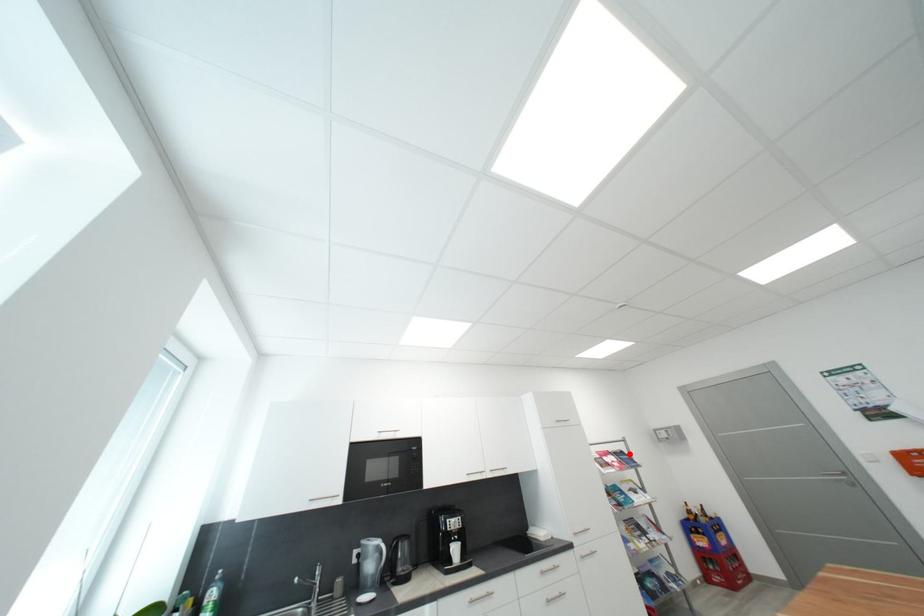
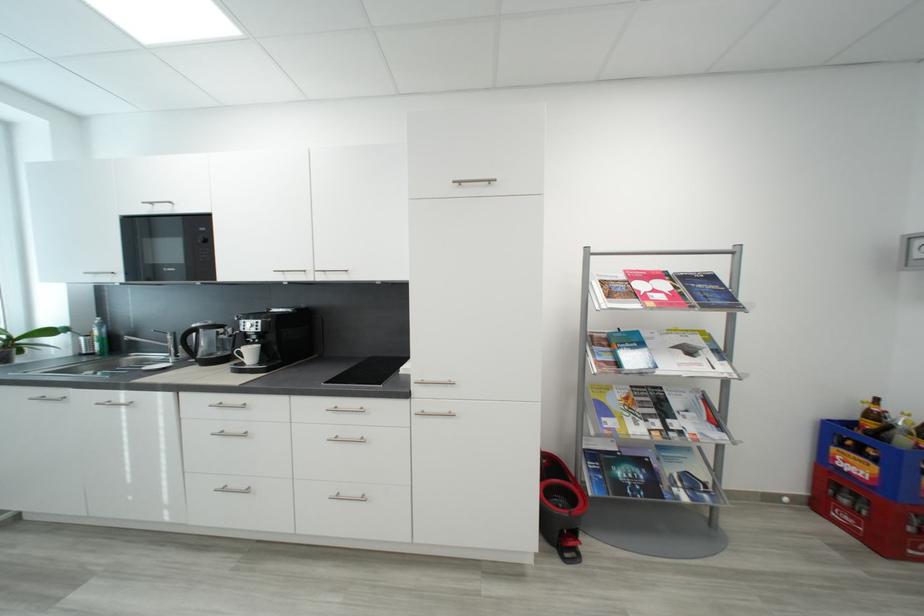
Where in the second image is the point corresponding to the highlighted location from the first image?

(718, 280)